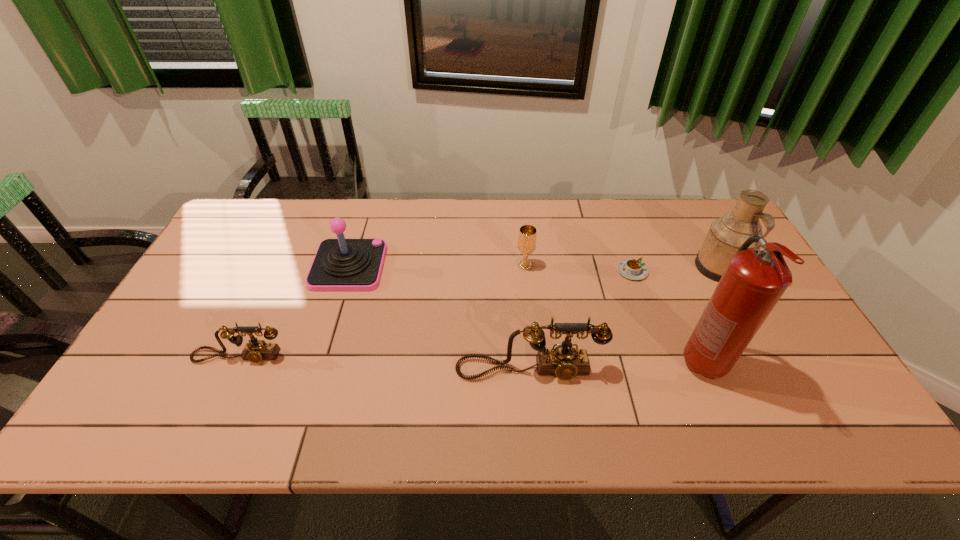
Image resolution: width=960 pixels, height=540 pixels. In order to click on the shorter telephone in this screenshot , I will do `click(256, 350)`.

The image size is (960, 540). In order to click on the sixth tallest object in this screenshot , I will do `click(256, 350)`.

You are a GUI agent. You are given a task and a screenshot of the screen. Output one action in this format:
    pyautogui.click(x=<x>, y=<y>)
    Task: Click on the taller telephone
    
    Given the screenshot: What is the action you would take?
    pyautogui.click(x=565, y=362)

Where is `chalice`? This screenshot has height=540, width=960. chalice is located at coordinates (526, 245).

This screenshot has width=960, height=540. Identify the location of joystick. (340, 264).

Find the location of `pudding`. pudding is located at coordinates (632, 269).

The image size is (960, 540). What are the coordinates of `the tallest object` in the screenshot? It's located at (753, 282).

You are a GUI agent. You are given a task and a screenshot of the screen. Output one action in this format:
    pyautogui.click(x=<x>, y=<y>)
    Task: Click on the sixth shortest object
    
    Given the screenshot: What is the action you would take?
    pyautogui.click(x=726, y=235)

The width and height of the screenshot is (960, 540). I want to click on pitcher, so click(x=726, y=235).

Find the location of `vacant area situated 0.080m on the front-facing side of the left telephone`. vacant area situated 0.080m on the front-facing side of the left telephone is located at coordinates (222, 394).